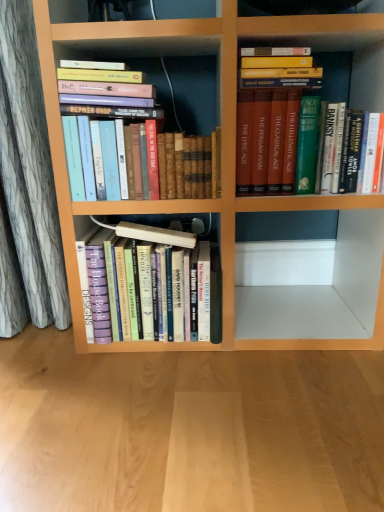
At what (x,y) coordinates should I click in order to perform the action: click on free space underneath hardcover books at upper left, the 1th book when ordered from left to right (from a real-world perspective). Please return your answer as a coordinate pair (x, y). Looking at the image, I should click on (140, 222).